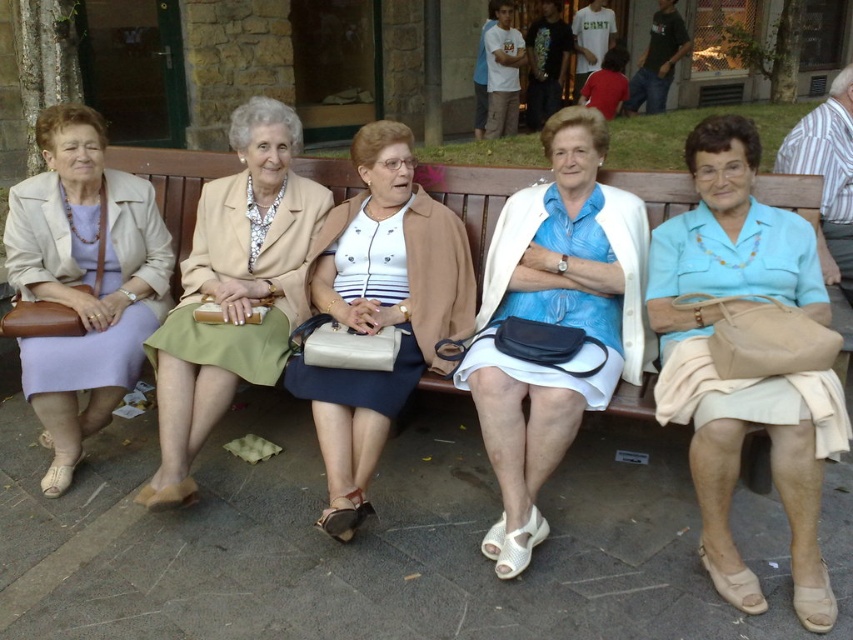
You are a photographer trying to capture a candid shot of the light blue fabric blouse at center and the matte beige blazer at center. Since you want to focus on the clothing details, which one should you adjust your camera focus to prioritize based on their positions?

The light blue fabric blouse at center is located below the matte beige blazer at center, so you should prioritize focusing on the matte beige blazer at center as it is closer to the camera.

You are a photographer trying to capture a clear shot of the light blue fabric blouse at center and the white matte skirt at center. Which one will be more visible in the photo if you focus on the front of the scene?

The light blue fabric blouse at center will be more visible because it is in front of the white matte skirt at center, so focusing on the front would make it appear clearer.

You are a photographer standing at the center of the scene. You want to take a photo of the light blue fabric blouse at center. Where should you aim your camera to capture it?

You should aim your camera at point (743, 378) to capture the light blue fabric blouse at center.